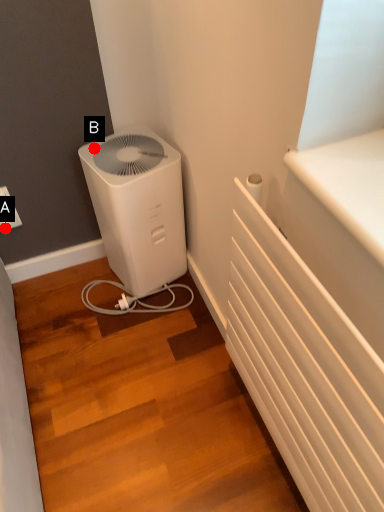
Question: Two points are circled on the image, labeled by A and B beside each circle. Which point is closer to the camera?

Choices:
 (A) A is closer
 (B) B is closer

Answer: (B)